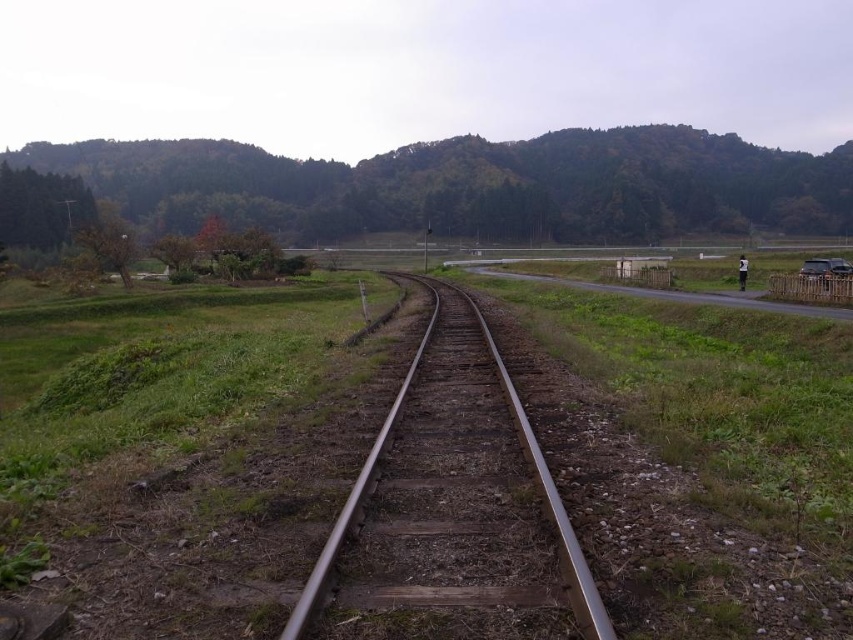
This screenshot has width=853, height=640. What do you see at coordinates (456, 506) in the screenshot? I see `metal/smooth track at center` at bounding box center [456, 506].

Does metal/smooth track at center have a lesser width compared to metallic silver car at right?

Correct, metal/smooth track at center's width is less than metallic silver car at right's.

This screenshot has width=853, height=640. Describe the element at coordinates (456, 506) in the screenshot. I see `metal/smooth track at center` at that location.

This screenshot has height=640, width=853. What are the coordinates of `metal/smooth track at center` in the screenshot? It's located at (456, 506).